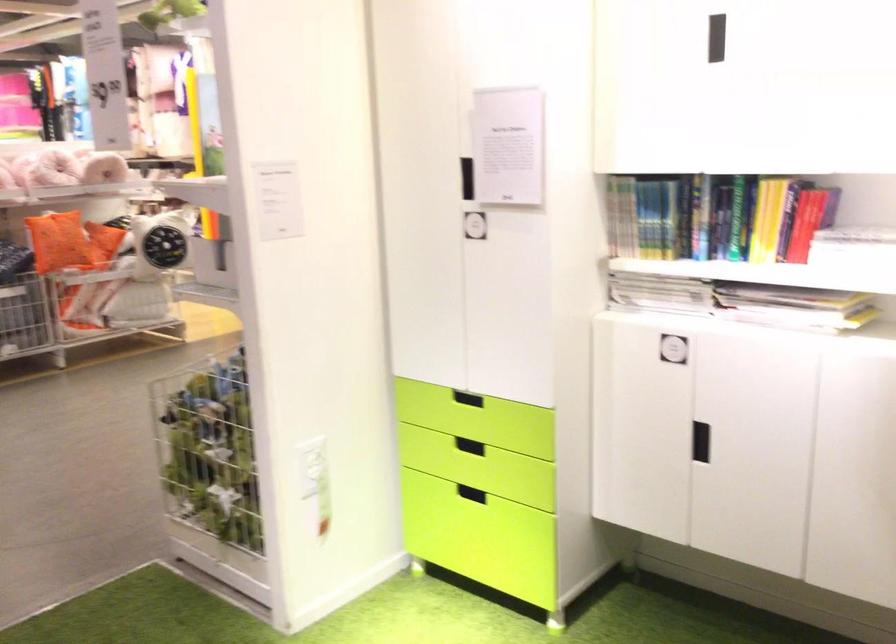
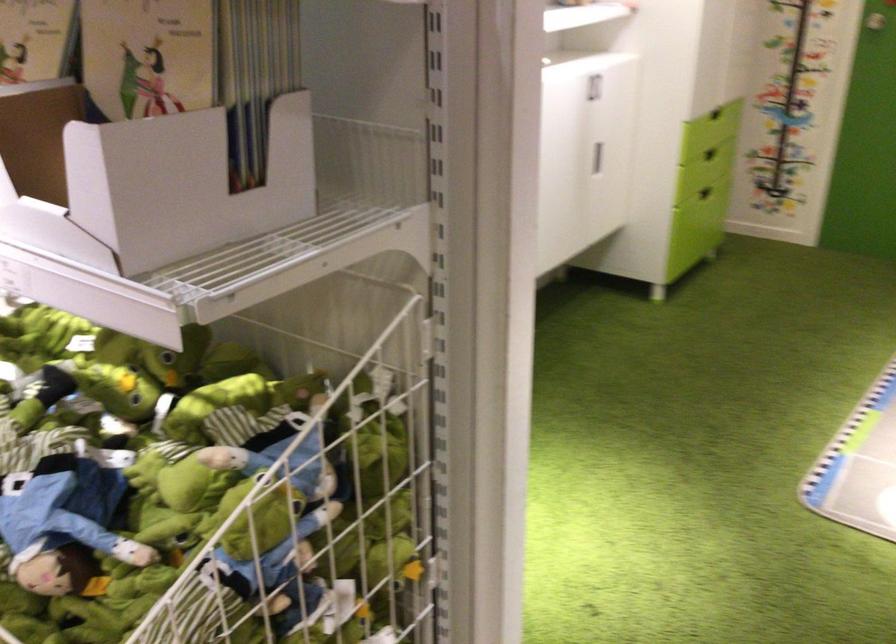
Question: I am providing you with two images of the same scene from different viewpoints. Please identify which objects are invisible in image2.

Choices:
 (A) door lever handle
 (B) stuffed frog toy
 (C) book
 (D) white cabinet handle

Answer: (C)